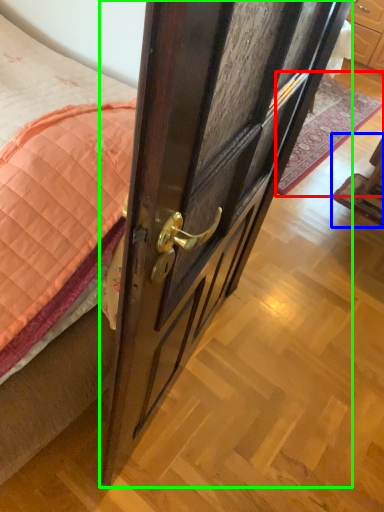
Question: Which object is the closest to the plain (highlighted by a red box)? Choose among these: furniture (highlighted by a blue box) or door (highlighted by a green box).

Choices:
 (A) furniture
 (B) door

Answer: (A)